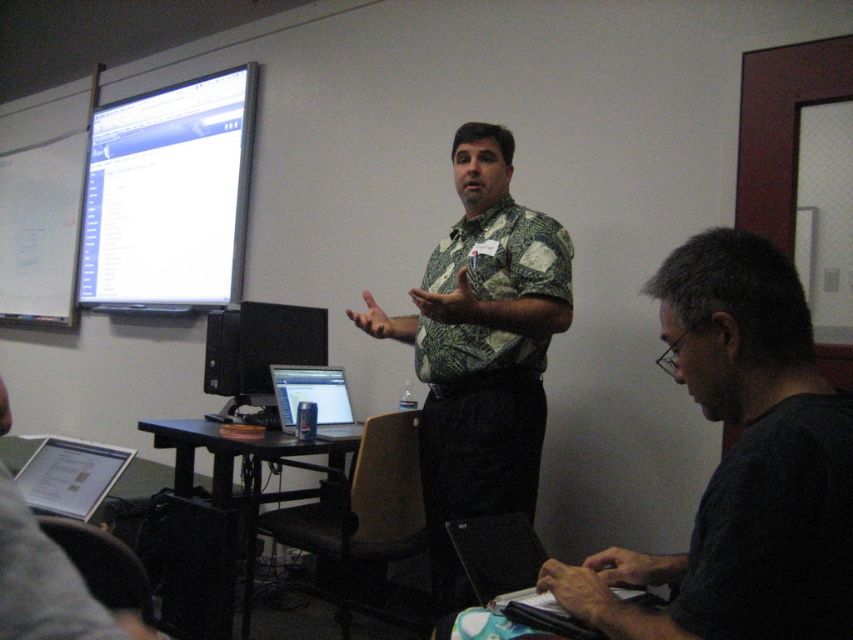
How much distance is there between matte black monitor at center and matte black laptop at center?

7.68 inches

What do you see at coordinates (276, 342) in the screenshot? The image size is (853, 640). I see `matte black monitor at center` at bounding box center [276, 342].

I want to click on matte black monitor at center, so click(x=276, y=342).

Which is more to the left, black matte laptop at lower right or matte black laptop at center?

matte black laptop at center is more to the left.

Locate an element on the screen. black matte laptop at lower right is located at coordinates 497,554.

Which is behind, point (132, 163) or point (277, 396)?

Point (132, 163)

Does point (178, 221) lie in front of point (283, 397)?

That is False.

I want to click on white glossy projection screen at upper left, so click(x=167, y=196).